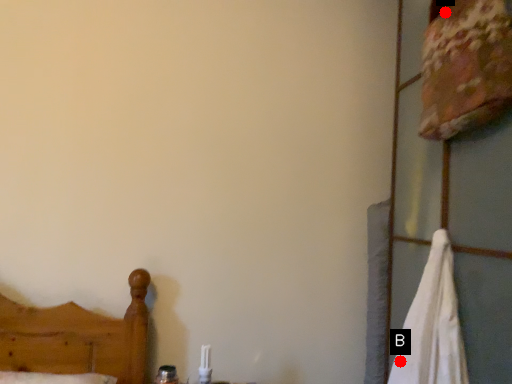
Question: Two points are circled on the image, labeled by A and B beside each circle. Which point is further to the camera?

Choices:
 (A) A is further
 (B) B is further

Answer: (A)